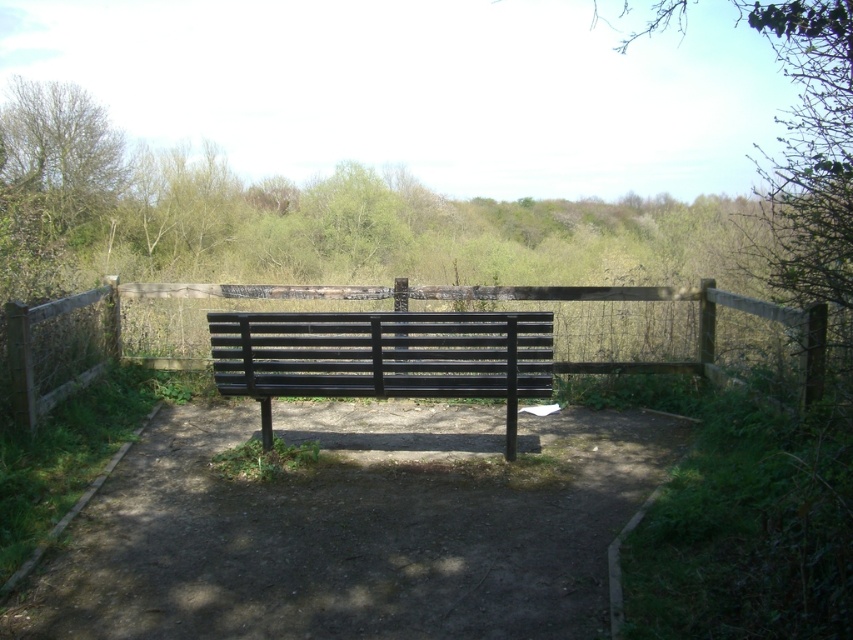
Can you confirm if dirt path at center is smaller than black metal bench at center?

Yes, dirt path at center is smaller than black metal bench at center.

Between dirt path at center and black metal bench at center, which one has less height?

dirt path at center

Find the location of a particular element. dirt path at center is located at coordinates (355, 528).

Is black metal bench at center above green leafy tree at upper left?

Incorrect, black metal bench at center is not positioned above green leafy tree at upper left.

Is black metal bench at center wider than green leafy tree at upper left?

Incorrect, black metal bench at center's width does not surpass green leafy tree at upper left's.

What are the coordinates of `black metal bench at center` in the screenshot? It's located at (383, 356).

At what (x,y) coordinates should I click in order to perform the action: click on black metal bench at center. Please return your answer as a coordinate pair (x, y). The width and height of the screenshot is (853, 640). Looking at the image, I should click on (383, 356).

What do you see at coordinates (383, 356) in the screenshot? The height and width of the screenshot is (640, 853). I see `black metal bench at center` at bounding box center [383, 356].

I want to click on black metal bench at center, so click(x=383, y=356).

Image resolution: width=853 pixels, height=640 pixels. What are the coordinates of `black metal bench at center` in the screenshot? It's located at (383, 356).

What are the coordinates of `black metal bench at center` in the screenshot? It's located at (383, 356).